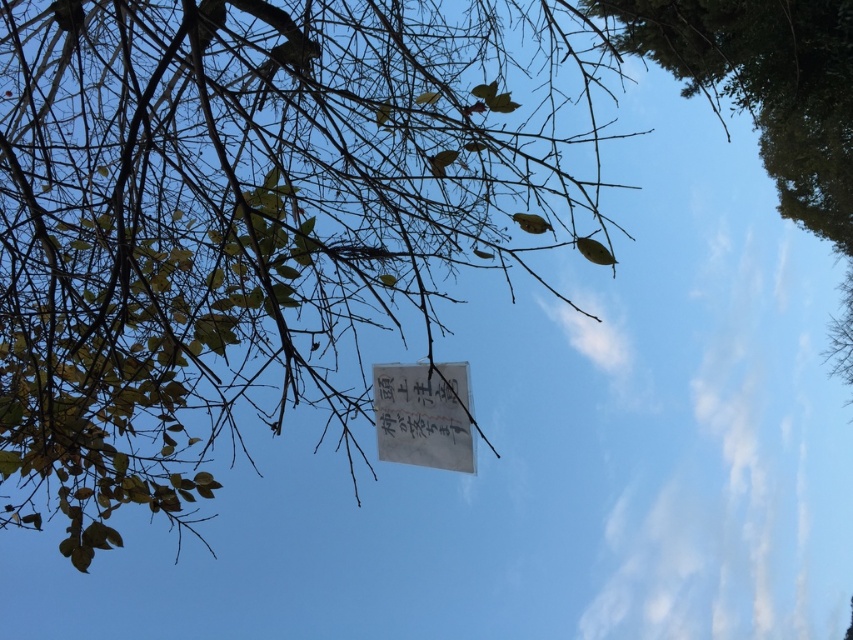
Between white paper at center and green leafy tree at upper right, which one has less height?

Standing shorter between the two is white paper at center.

Who is taller, white paper at center or green leafy tree at upper right?

With more height is green leafy tree at upper right.

Image resolution: width=853 pixels, height=640 pixels. I want to click on white paper at center, so click(252, 216).

The width and height of the screenshot is (853, 640). Describe the element at coordinates (769, 99) in the screenshot. I see `green leafy tree at upper right` at that location.

From the picture: Can you confirm if green leafy tree at upper right is positioned above white paper sign at center?

Yes.

Find the location of `green leafy tree at upper right`. green leafy tree at upper right is located at coordinates (769, 99).

You are a GUI agent. You are given a task and a screenshot of the screen. Output one action in this format:
    pyautogui.click(x=<x>, y=<y>)
    Task: Click on the green leafy tree at upper right
    
    Given the screenshot: What is the action you would take?
    pyautogui.click(x=769, y=99)

Does white paper at center lie in front of white paper sign at center?

Yes, it is in front of white paper sign at center.

Measure the distance between white paper at center and white paper sign at center.

A distance of 26.35 inches exists between white paper at center and white paper sign at center.

Is point (289, 349) farther from camera compared to point (444, 448)?

Yes, it is behind point (444, 448).

Locate an element on the screen. This screenshot has height=640, width=853. white paper at center is located at coordinates (252, 216).